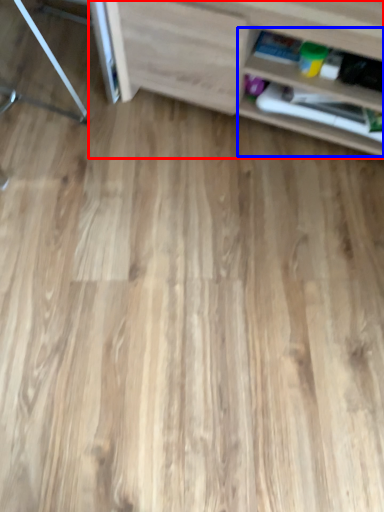
Question: Among these objects, which one is farthest to the camera, shelf (highlighted by a red box) or shelf (highlighted by a blue box)?

Choices:
 (A) shelf
 (B) shelf

Answer: (B)